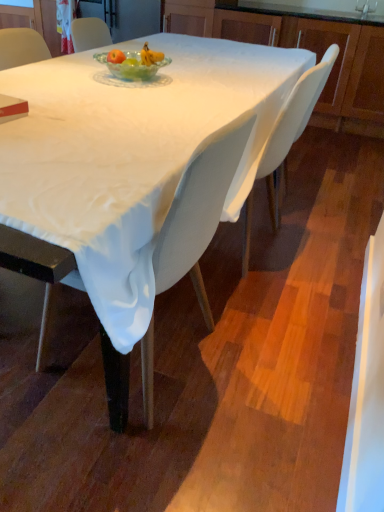
Image resolution: width=384 pixels, height=512 pixels. Find the location of `unoccupied region to the right of matte red book at lower left`. unoccupied region to the right of matte red book at lower left is located at coordinates (44, 127).